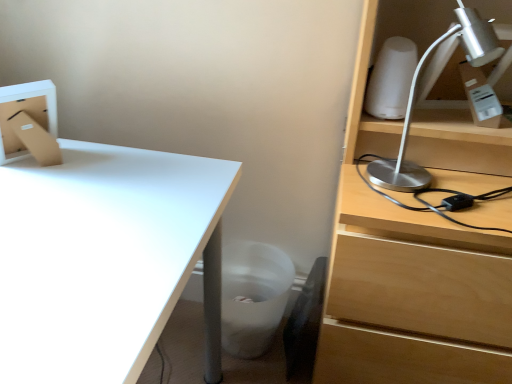
Looking at this image, measure the distance between silver metallic desk lamp at upper right and camera.

A distance of 27.35 inches exists between silver metallic desk lamp at upper right and camera.

What do you see at coordinates (253, 296) in the screenshot? The width and height of the screenshot is (512, 384). I see `white matte trash bin/can at lower center` at bounding box center [253, 296].

Image resolution: width=512 pixels, height=384 pixels. In order to click on white glossy desk at lower left in this screenshot , I will do `click(103, 258)`.

I want to click on silver metallic desk lamp at upper right, so click(x=415, y=96).

Can you confirm if white glossy desk at lower left is bigger than black leather swivel chair at lower center?

Yes.

From a real-world perspective, is white glossy desk at lower left located beneath black leather swivel chair at lower center?

No, from a real-world perspective, white glossy desk at lower left is not beneath black leather swivel chair at lower center.

Considering the positions of points (68, 299) and (290, 334), is point (68, 299) closer to camera compared to point (290, 334)?

That is True.

Is white glossy desk at lower left turned away from black leather swivel chair at lower center?

No, white glossy desk at lower left is not facing the opposite direction of black leather swivel chair at lower center.

Considering the points (90, 148) and (374, 162), which point is behind, point (90, 148) or point (374, 162)?

The point (90, 148) is farther.

Does white glossy desk at lower left have a larger size compared to silver metallic desk lamp at upper right?

Indeed, white glossy desk at lower left has a larger size compared to silver metallic desk lamp at upper right.

Which object is further away from the camera, white glossy desk at lower left or silver metallic desk lamp at upper right?

silver metallic desk lamp at upper right is behind.

Is white matte trash bin/can at lower center to the left or to the right of black leather swivel chair at lower center in the image?

Clearly, white matte trash bin/can at lower center is on the left of black leather swivel chair at lower center in the image.

From a real-world perspective, between white matte trash bin/can at lower center and black leather swivel chair at lower center, who is vertically lower?

From a 3D spatial view, white matte trash bin/can at lower center is below.

Considering the positions of point (224, 346) and point (317, 301), is point (224, 346) closer or farther from the camera than point (317, 301)?

Clearly, point (224, 346) is closer to the camera than point (317, 301).

Based on the photo, does white matte trash bin/can at lower center turn towards black leather swivel chair at lower center?

Yes.

In the scene shown: Could you tell me if black leather swivel chair at lower center is facing white glossy desk at lower left?

No, black leather swivel chair at lower center is not aimed at white glossy desk at lower left.

Which of these two, black leather swivel chair at lower center or white glossy desk at lower left, stands shorter?

black leather swivel chair at lower center.

Consider the image. From a real-world perspective, is black leather swivel chair at lower center above or below white glossy desk at lower left?

In terms of real-world spatial position, black leather swivel chair at lower center is below white glossy desk at lower left.

From the image's perspective, is black leather swivel chair at lower center located above or below white glossy desk at lower left?

black leather swivel chair at lower center is below white glossy desk at lower left.

Image resolution: width=512 pixels, height=384 pixels. What are the coordinates of `swivel chair on the left of silver metallic desk lamp at upper right` in the screenshot? It's located at (305, 324).

Considering the sizes of objects silver metallic desk lamp at upper right and black leather swivel chair at lower center in the image provided, who is bigger, silver metallic desk lamp at upper right or black leather swivel chair at lower center?

With larger size is silver metallic desk lamp at upper right.

Considering the relative positions of silver metallic desk lamp at upper right and black leather swivel chair at lower center in the image provided, is silver metallic desk lamp at upper right in front of black leather swivel chair at lower center?

Yes, the depth of silver metallic desk lamp at upper right is less than that of black leather swivel chair at lower center.

Is black leather swivel chair at lower center far from white matte trash bin/can at lower center?

No, there isn't a large distance between black leather swivel chair at lower center and white matte trash bin/can at lower center.

From a real-world perspective, does black leather swivel chair at lower center stand above white matte trash bin/can at lower center?

Yes, from a real-world perspective, black leather swivel chair at lower center is over white matte trash bin/can at lower center

Is black leather swivel chair at lower center positioned beyond the bounds of white matte trash bin/can at lower center?

No, black leather swivel chair at lower center is inside white matte trash bin/can at lower center's boundary.

Is white matte trash bin/can at lower center at the right side of silver metallic desk lamp at upper right?

No, white matte trash bin/can at lower center is not to the right of silver metallic desk lamp at upper right.

Do you think white matte trash bin/can at lower center is within silver metallic desk lamp at upper right, or outside of it?

white matte trash bin/can at lower center is not enclosed by silver metallic desk lamp at upper right.

Which is behind, point (240, 330) or point (494, 46)?

The point (240, 330) is farther.

The height and width of the screenshot is (384, 512). Find the location of `desk above the black leather swivel chair at lower center (from a real-world perspective)`. desk above the black leather swivel chair at lower center (from a real-world perspective) is located at coordinates (103, 258).

The image size is (512, 384). In the image, there is a silver metallic desk lamp at upper right. In order to click on desk below it (from the image's perspective) in this screenshot , I will do `click(103, 258)`.

In the scene shown: Based on their spatial positions, is white glossy desk at lower left or white matte trash bin/can at lower center closer to black leather swivel chair at lower center?

Among the two, white matte trash bin/can at lower center is located nearer to black leather swivel chair at lower center.

From the image, which object appears to be nearer to silver metallic desk lamp at upper right, white matte trash bin/can at lower center or black leather swivel chair at lower center?

white matte trash bin/can at lower center lies closer to silver metallic desk lamp at upper right than the other object.

Estimate the real-world distances between objects in this image. Which object is further from silver metallic desk lamp at upper right, black leather swivel chair at lower center or white matte trash bin/can at lower center?

black leather swivel chair at lower center lies further to silver metallic desk lamp at upper right than the other object.

Considering their positions, is white matte trash bin/can at lower center positioned further to black leather swivel chair at lower center than silver metallic desk lamp at upper right?

Among the two, silver metallic desk lamp at upper right is located further to black leather swivel chair at lower center.

Considering their positions, is black leather swivel chair at lower center positioned further to white glossy desk at lower left than silver metallic desk lamp at upper right?

Based on the image, black leather swivel chair at lower center appears to be further to white glossy desk at lower left.

Considering their positions, is silver metallic desk lamp at upper right positioned further to white matte trash bin/can at lower center than black leather swivel chair at lower center?

silver metallic desk lamp at upper right.

Based on their spatial positions, is white glossy desk at lower left or black leather swivel chair at lower center further from silver metallic desk lamp at upper right?

black leather swivel chair at lower center.

Looking at the image, which one is located closer to silver metallic desk lamp at upper right, black leather swivel chair at lower center or white glossy desk at lower left?

white glossy desk at lower left is closer to silver metallic desk lamp at upper right.

Find the location of a particular element. The image size is (512, 384). swivel chair between white glossy desk at lower left and white matte trash bin/can at lower center in the front-back direction is located at coordinates (305, 324).

Identify the location of swivel chair between silver metallic desk lamp at upper right and white matte trash bin/can at lower center from front to back. This screenshot has height=384, width=512. (305, 324).

Where is `lamp between white glossy desk at lower left and black leather swivel chair at lower center from front to back`? The height and width of the screenshot is (384, 512). lamp between white glossy desk at lower left and black leather swivel chair at lower center from front to back is located at coordinates (415, 96).

The width and height of the screenshot is (512, 384). I want to click on lamp between white glossy desk at lower left and white matte trash bin/can at lower center in the front-back direction, so click(x=415, y=96).